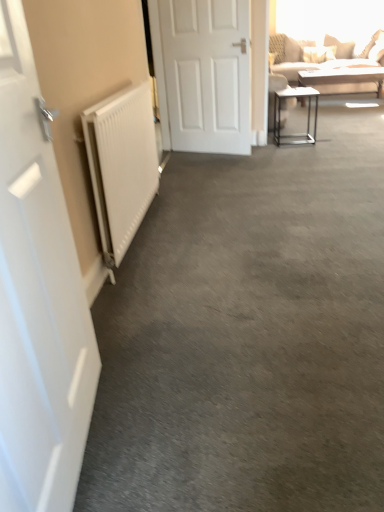
Question: Considering their positions, is white matte radiator at left located in front of or behind metallic silver table at right, which ranks as the first table in left-to-right order?

Choices:
 (A) behind
 (B) front

Answer: (B)

Question: Would you say white matte radiator at left is to the left or to the right of metallic silver table at right, which ranks as the 2th table in right-to-left order, in the picture?

Choices:
 (A) right
 (B) left

Answer: (B)

Question: Which is nearer to the white matte radiator at left?

Choices:
 (A) beige fabric couch at upper right
 (B) white matte door at left, acting as the first door starting from the front
 (C) white glossy table at upper right, which ranks as the 2th table in left-to-right order
 (D) metallic silver table at right, positioned as the 2th table in back-to-front order
 (E) white matte door at center, acting as the first door starting from the right

Answer: (B)

Question: Based on their relative distances, which object is farther from the white matte door at center, which is the 2th door in left-to-right order?

Choices:
 (A) white glossy table at upper right, which ranks as the 2th table in left-to-right order
 (B) beige fabric couch at upper right
 (C) white matte door at left, acting as the 1th door starting from the bottom
 (D) white matte radiator at left
 (E) metallic silver table at right, which ranks as the 2th table in right-to-left order

Answer: (C)